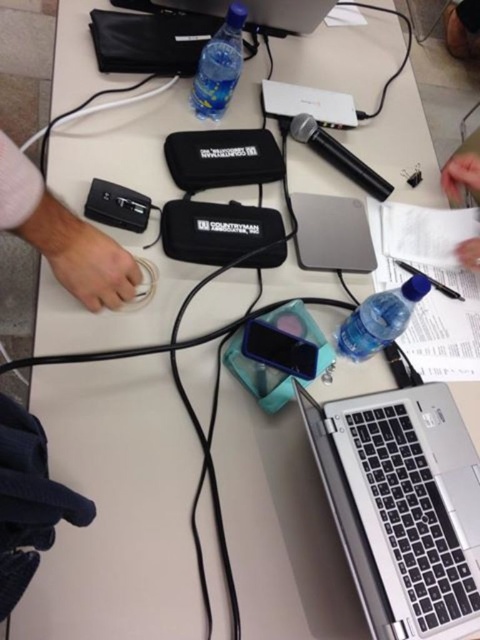
Question: Is white paper at upper right wider than black plastic pen at right?

Choices:
 (A) no
 (B) yes

Answer: (A)

Question: Which object appears farthest from the camera in this image?

Choices:
 (A) translucent plastic bottle at lower right
 (B) black matte usb hub at left
 (C) silver metallic laptop at upper center

Answer: (C)

Question: Which of the following is the closest to the observer?

Choices:
 (A) (450, 192)
 (B) (410, 544)
 (C) (33, 198)
 (D) (237, 8)

Answer: (C)

Question: Is white paper at upper right below black plastic pen at right?

Choices:
 (A) no
 (B) yes

Answer: (A)

Question: Does silver metallic laptop at upper center appear over black plastic pen at right?

Choices:
 (A) no
 (B) yes

Answer: (B)

Question: Among these points, which one is farthest from the camera?

Choices:
 (A) (463, 256)
 (B) (17, 160)
 (C) (254, 17)
 (D) (350, 529)

Answer: (C)